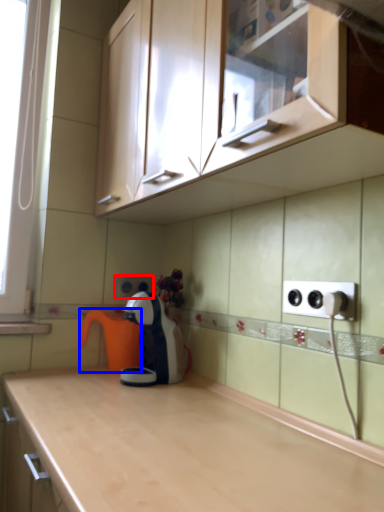
Question: Which object is closer to the camera taking this photo, electric outlet (highlighted by a red box) or coffeepot (highlighted by a blue box)?

Choices:
 (A) electric outlet
 (B) coffeepot

Answer: (B)